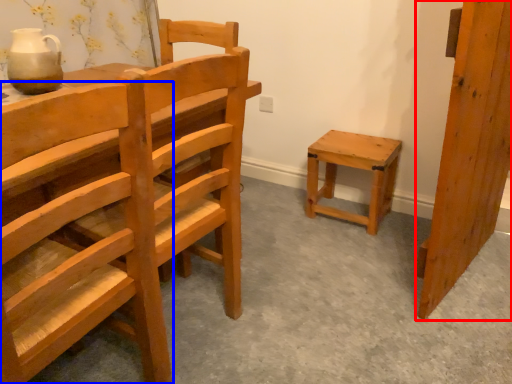
Question: Among these objects, which one is farthest to the camera, wood (highlighted by a red box) or chair (highlighted by a blue box)?

Choices:
 (A) wood
 (B) chair

Answer: (A)